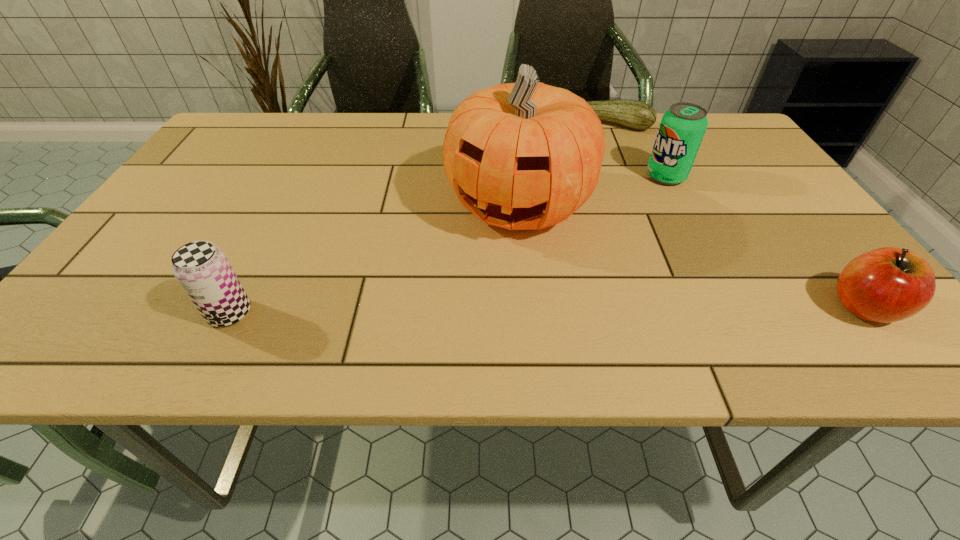
Locate an element on the screen. beer can is located at coordinates (202, 269).

Locate an element on the screen. The image size is (960, 540). apple is located at coordinates (884, 285).

Identify the location of pop soda. click(x=682, y=128).

I want to click on pumpkin, so click(521, 156).

This screenshot has width=960, height=540. In order to click on zucchini in this screenshot , I will do `click(638, 115)`.

You are a GUI agent. You are given a task and a screenshot of the screen. Output one action in this format:
    pyautogui.click(x=<x>, y=<y>)
    Task: Click on the shortest object
    
    Given the screenshot: What is the action you would take?
    pyautogui.click(x=638, y=115)

Locate an element on the screen. This screenshot has height=540, width=960. vacant region located 0.090m on the back of the beer can is located at coordinates (255, 263).

Identify the location of vacant area situated on the back of the rightmost object. (760, 176).

Identify the location of vacant position located on the front-facing side of the pop soda. This screenshot has width=960, height=540. (550, 253).

Where is `vacant space situated 0.090m on the front-facing side of the pop soda`? The height and width of the screenshot is (540, 960). vacant space situated 0.090m on the front-facing side of the pop soda is located at coordinates (633, 199).